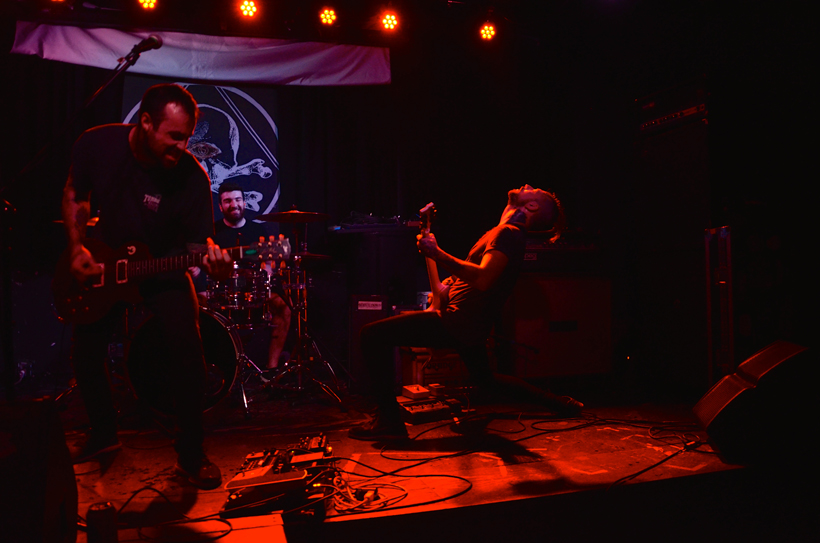
Identify the location of spotlights. The width and height of the screenshot is (820, 543). (146, 2), (254, 17), (335, 17), (380, 14), (488, 28).